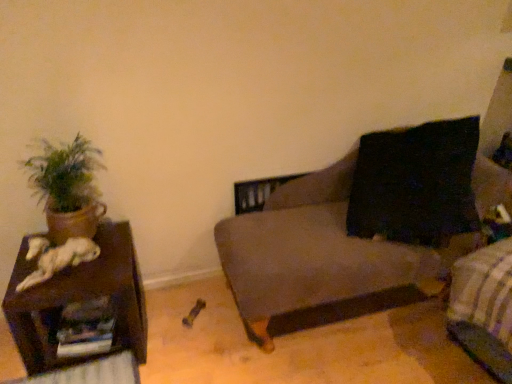
Find the location of `vacant area that is in front of green matte plant at left`. vacant area that is in front of green matte plant at left is located at coordinates (83, 276).